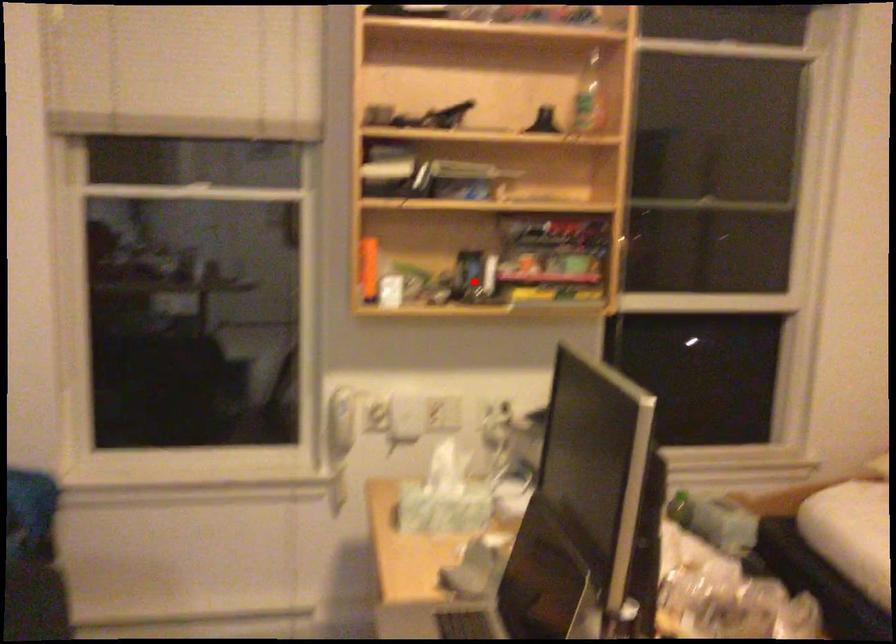
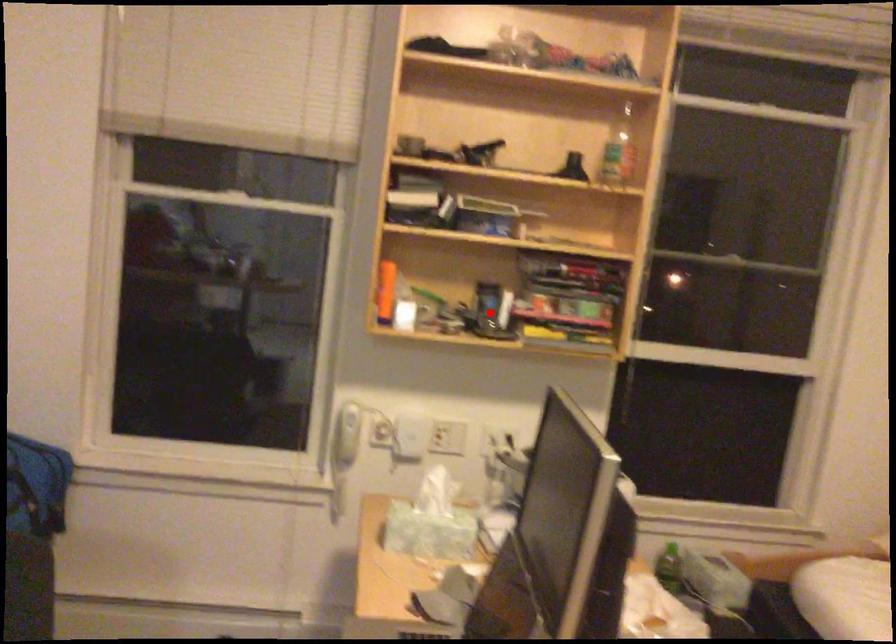
I am providing you with two images of the same scene from different viewpoints. A red point is marked on the first image and another point is marked on the second image. Is the red point in image1 aligned with the point shown in image2?

Yes